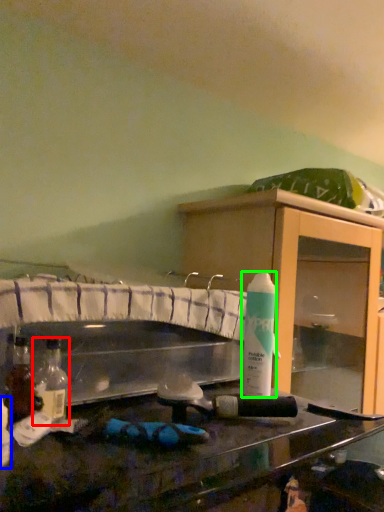
Question: Considering the real-world distances, which object is closest to bottle (highlighted by a red box)? bottle (highlighted by a blue box) or cleaning product (highlighted by a green box).

Choices:
 (A) bottle
 (B) cleaning product

Answer: (A)